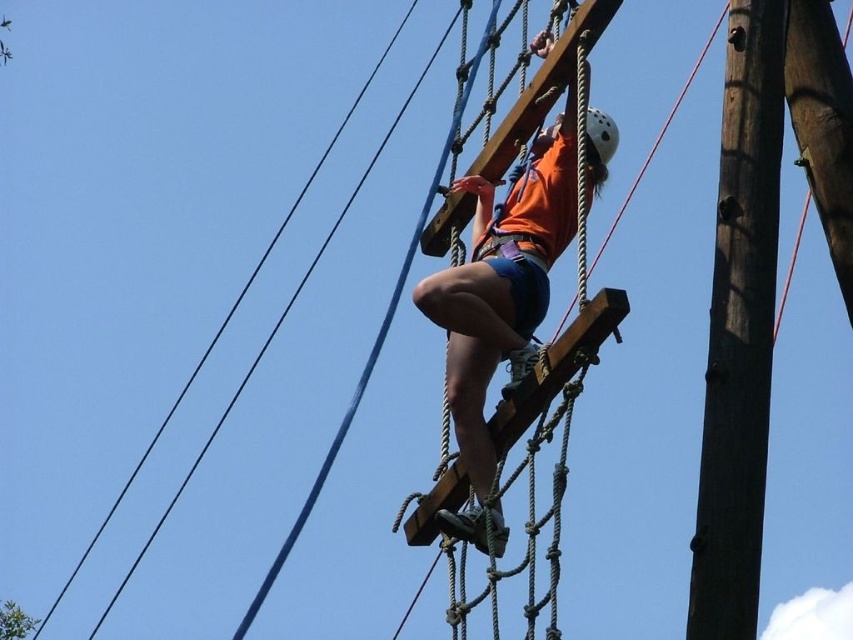
Question: Is orange fabric shirt at center to the right of white matte helmet at upper center from the viewer's perspective?

Choices:
 (A) no
 (B) yes

Answer: (A)

Question: Which is nearer to the orange fabric shirt at center?

Choices:
 (A) brown rough wood pole at right
 (B) white matte helmet at upper center

Answer: (B)

Question: Which point appears farthest from the camera in this image?

Choices:
 (A) (717, 436)
 (B) (612, 147)
 (C) (463, 276)

Answer: (B)

Question: Where is orange fabric shirt at center located in relation to white matte helmet at upper center in the image?

Choices:
 (A) below
 (B) above

Answer: (A)

Question: Can you confirm if brown rough wood pole at right is positioned to the left of orange fabric shirt at center?

Choices:
 (A) no
 (B) yes

Answer: (A)

Question: Which is farther from the white matte helmet at upper center?

Choices:
 (A) brown rough wood pole at right
 (B) orange fabric shirt at center

Answer: (A)